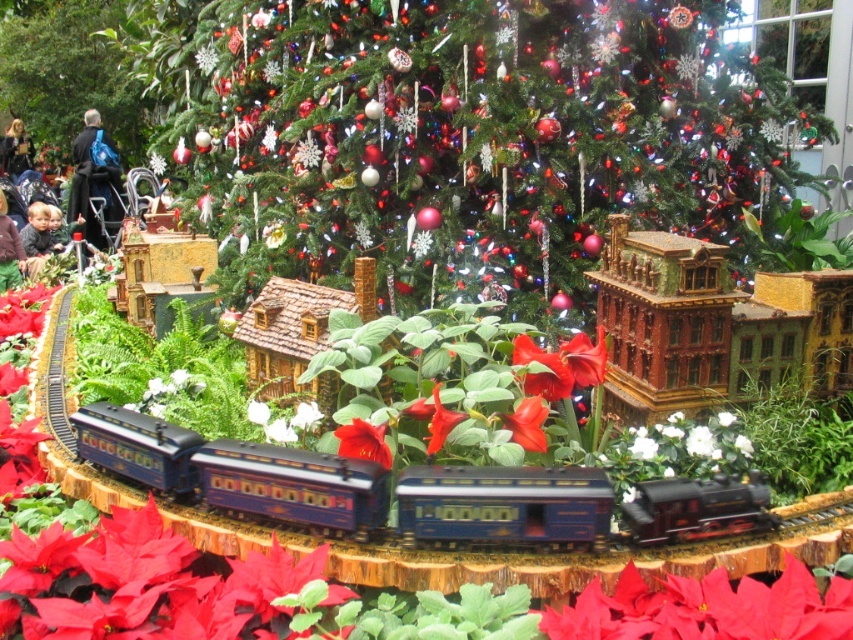
Can you confirm if shiny green christmas tree at center is bigger than shiny blue train at center?

Correct, shiny green christmas tree at center is larger in size than shiny blue train at center.

Does shiny green christmas tree at center have a greater width compared to shiny blue train at center?

Correct, the width of shiny green christmas tree at center exceeds that of shiny blue train at center.

Is point (419, 132) more distant than point (657, 480)?

Yes.

This screenshot has width=853, height=640. I want to click on shiny green christmas tree at center, so click(x=462, y=134).

Can you confirm if green matte christmas tree at upper center is smaller than dark brown leather jacket at upper left?

Actually, green matte christmas tree at upper center might be larger than dark brown leather jacket at upper left.

Which is behind, point (93, 58) or point (33, 154)?

The point (33, 154) is behind.

Locate an element on the screen. Image resolution: width=853 pixels, height=640 pixels. green matte christmas tree at upper center is located at coordinates (68, 72).

Between shiny green christmas tree at center and dark brown leather jacket at upper left, which one appears on the right side from the viewer's perspective?

Positioned to the right is shiny green christmas tree at center.

Which is below, shiny green christmas tree at center or dark brown leather jacket at upper left?

shiny green christmas tree at center is lower down.

Is point (323, 273) positioned in front of point (10, 150)?

That is True.

Find the location of a particular element. shiny green christmas tree at center is located at coordinates (462, 134).